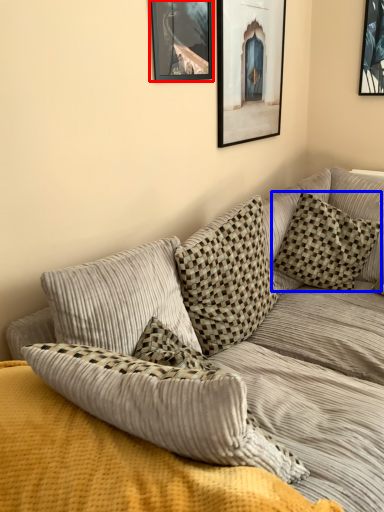
Question: Which object is closer to the camera taking this photo, picture frame (highlighted by a red box) or pillow (highlighted by a blue box)?

Choices:
 (A) picture frame
 (B) pillow

Answer: (A)